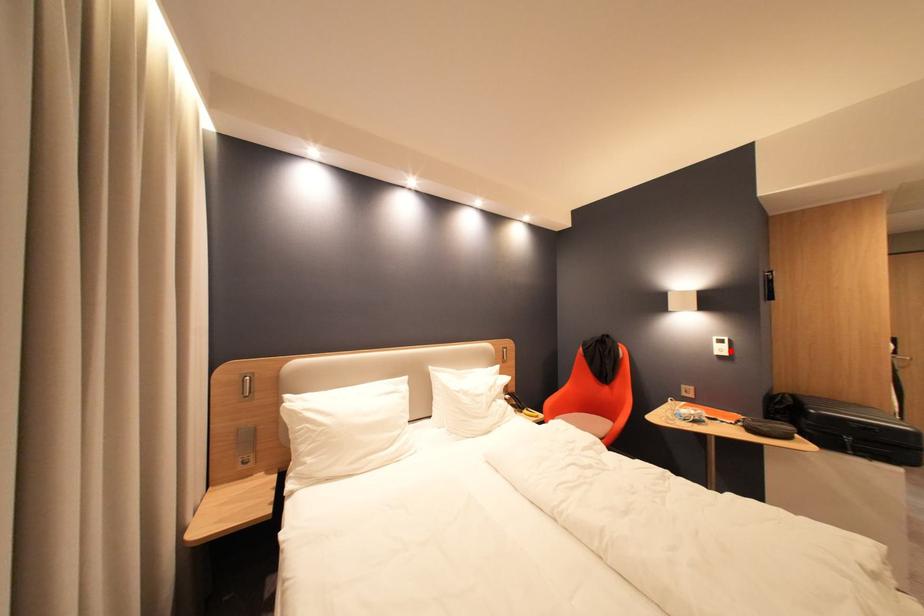
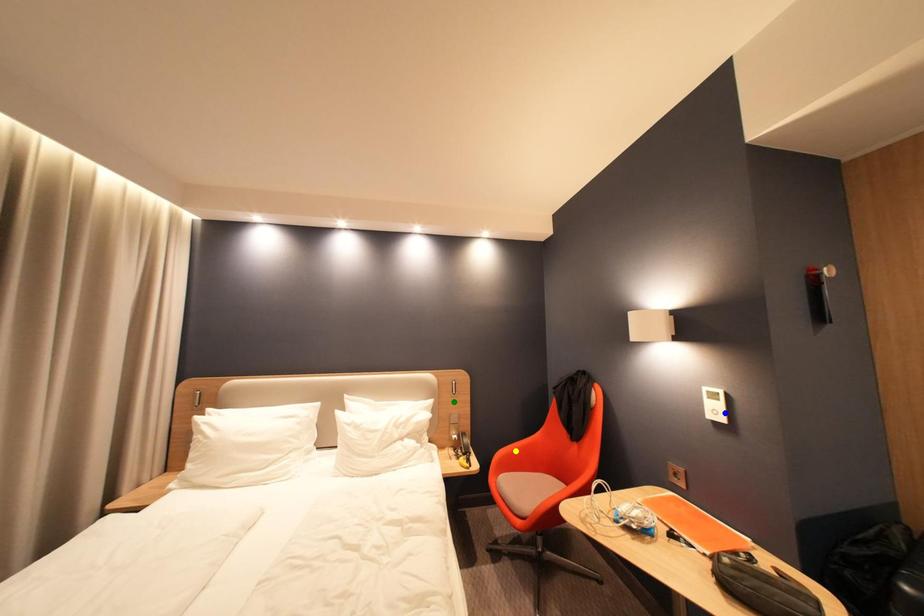
Question: I am providing you with two images of the same scene from different viewpoints. A red point is marked on the first image. You are given multiple points on the second image. Which point in image 2 represents the same 3d spot as the red point in image 1?

Choices:
 (A) green point
 (B) yellow point
 (C) blue point

Answer: (C)